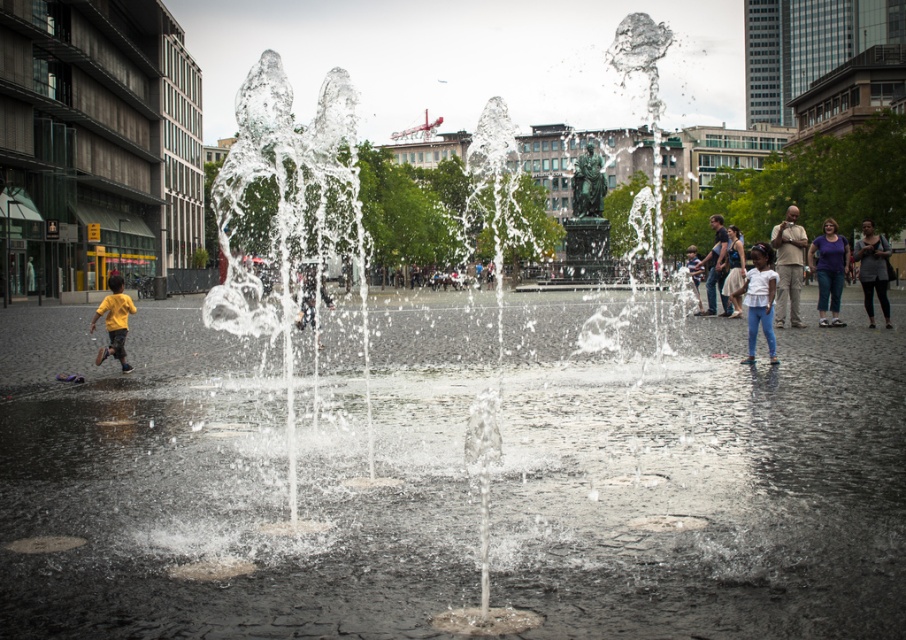
Question: Which point is farther to the camera?

Choices:
 (A) tan khaki pants at right
 (B) denim skirt at right
 (C) purple cotton shirt at lower right

Answer: (B)

Question: Among these objects, which one is farthest from the camera?

Choices:
 (A) yellow matte shirt at left
 (B) light blue jeans at right
 (C) tan khaki pants at right

Answer: (C)

Question: Can you confirm if purple cotton shirt at lower right is positioned to the left of yellow matte shirt at left?

Choices:
 (A) yes
 (B) no

Answer: (B)

Question: Which object is closer to the camera taking this photo?

Choices:
 (A) light blue jeans at right
 (B) yellow matte shirt at left
 (C) purple cotton shirt at lower right
 (D) tan khaki pants at right

Answer: (A)

Question: Is dark gray fabric pants at right above denim skirt at right?

Choices:
 (A) no
 (B) yes

Answer: (B)

Question: Can you confirm if tan khaki pants at right is positioned above purple cotton shirt at lower right?

Choices:
 (A) no
 (B) yes

Answer: (A)